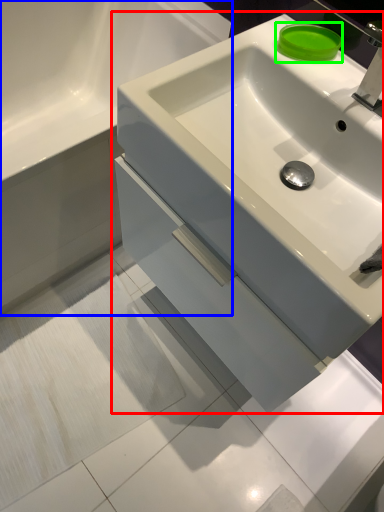
Question: Based on their relative distances, which object is farther from sink (highlighted by a red box)? Choose from bathroom cabinet (highlighted by a blue box) and soap (highlighted by a green box).

Choices:
 (A) bathroom cabinet
 (B) soap

Answer: (A)